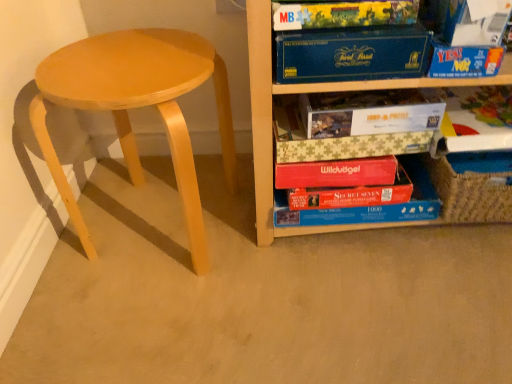
Where is `blank space situated above light wood stool at left (from a real-world perspective)`? blank space situated above light wood stool at left (from a real-world perspective) is located at coordinates (136, 57).